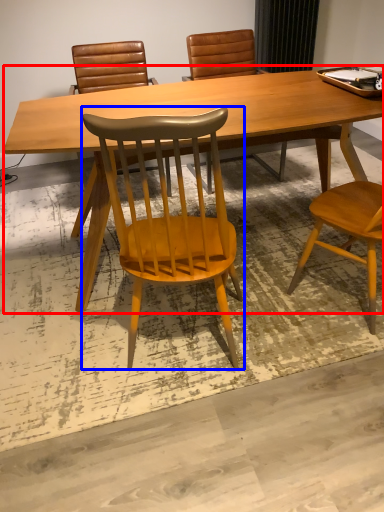
Question: Among these objects, which one is nearest to the camera, desk (highlighted by a red box) or chair (highlighted by a blue box)?

Choices:
 (A) desk
 (B) chair

Answer: (B)